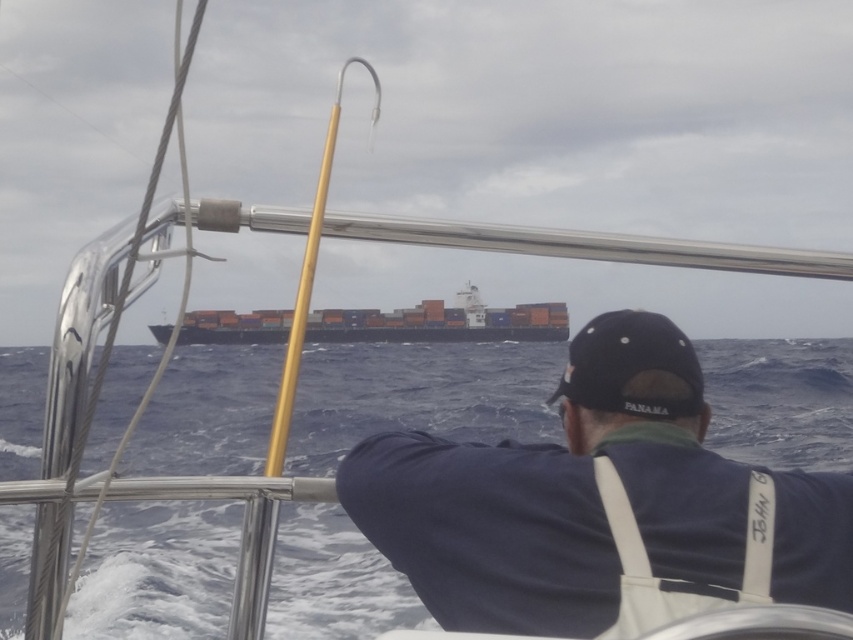
Is blue water at center closer to camera compared to orange matte container ship at center?

That is True.

Is blue water at center to the right of orange matte container ship at center from the viewer's perspective?

In fact, blue water at center is to the left of orange matte container ship at center.

Who is more forward, (154, 362) or (386, 323)?

Positioned in front is point (154, 362).

What are the coordinates of `blue water at center` in the screenshot? It's located at (421, 396).